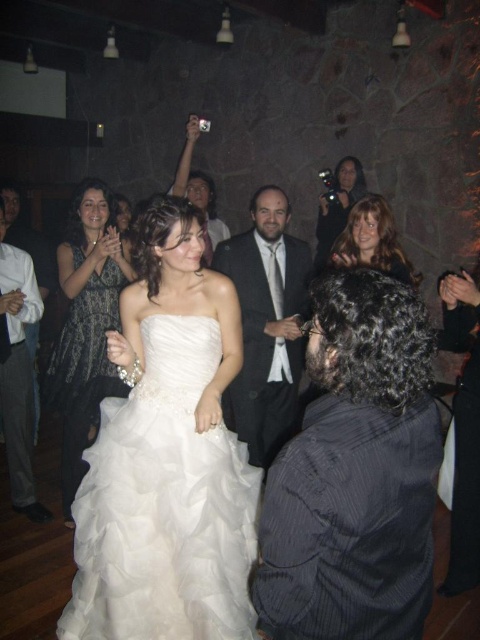
In the scene shown: You are a photographer at the wedding reception and want to capture both the matte black dress at left and the dark gray textured dress at upper left in a single frame. Based on their positions, will you need to adjust your camera angle upwards or downwards to include both dresses in the photo?

The matte black dress at left is located below the dark gray textured dress at upper left, so you will need to adjust your camera angle downwards to include both dresses in the photo.

You are standing at the point with coordinates point (81, 296) and want to walk to the point with coordinates point (84, 212). Is there a clear path between these two points?

Point (84, 212) is behind point (81, 296), so there might be an obstacle between them. Therefore, the path may not be clear.